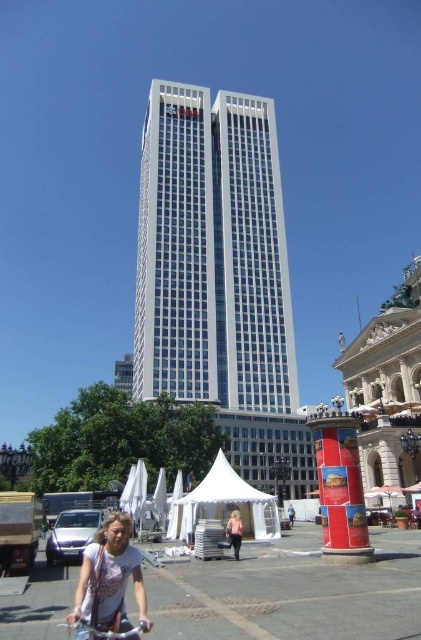
Question: Among these points, which one is farthest from the camera?

Choices:
 (A) (135, 627)
 (B) (104, 602)
 (C) (178, 378)
 (D) (234, 520)

Answer: (C)

Question: Which object appears closest to the camera in this image?

Choices:
 (A) pink fabric umbrella at lower center
 (B) silver metallic bicycle at lower center

Answer: (B)

Question: Can you confirm if white t-shirt at lower center is thinner than pink fabric umbrella at lower center?

Choices:
 (A) yes
 (B) no

Answer: (B)

Question: Which point is closer to the camera?

Choices:
 (A) (127, 616)
 (B) (215, 324)
 (C) (79, 627)

Answer: (C)

Question: In this image, where is silver metallic bicycle at lower center located relative to pink fabric umbrella at lower center?

Choices:
 (A) below
 (B) above

Answer: (B)

Question: Is white glass building at center in front of silver metallic bicycle at lower center?

Choices:
 (A) no
 (B) yes

Answer: (A)